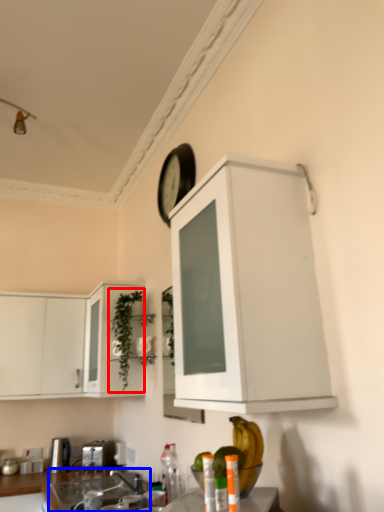
Question: Among these objects, which one is farthest to the camera, plant (highlighted by a red box) or sink (highlighted by a blue box)?

Choices:
 (A) plant
 (B) sink

Answer: (A)